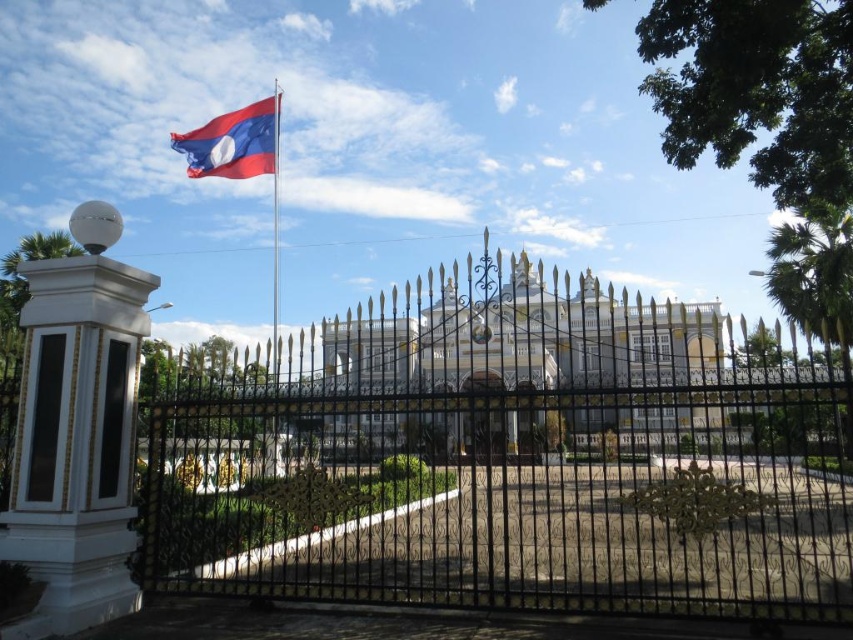
You are standing in front of the grand building and want to take a photo of the red matte flag at upper left. However, the black wrought iron fence at center might block your view. Based on their positions, can you see the flag clearly without the fence obstructing it?

The black wrought iron fence at center is in front of the red matte flag at upper left, so the fence will block your view of the flag.

You are standing in front of the grand ornate building and want to locate the exact spot where the point at coordinates (523,339) is marked. Based on the scene description, where would this point be located relative to the white column and the black wrought iron fence?

The point at coordinates (523,339) corresponds to the white glossy palace at center, which is located behind the black wrought iron fence and to the right of the white column with a spherical top.